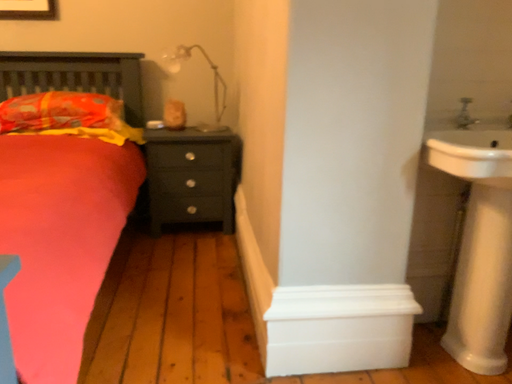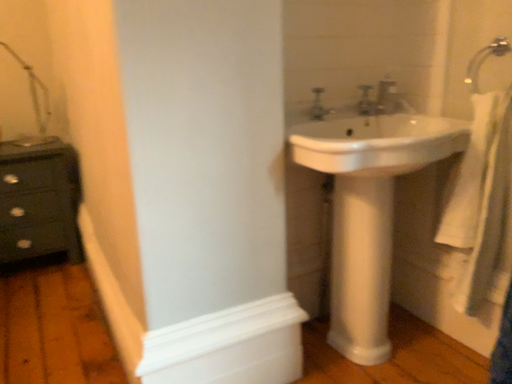
Question: Which way did the camera rotate in the video?

Choices:
 (A) rotated right
 (B) rotated left

Answer: (A)